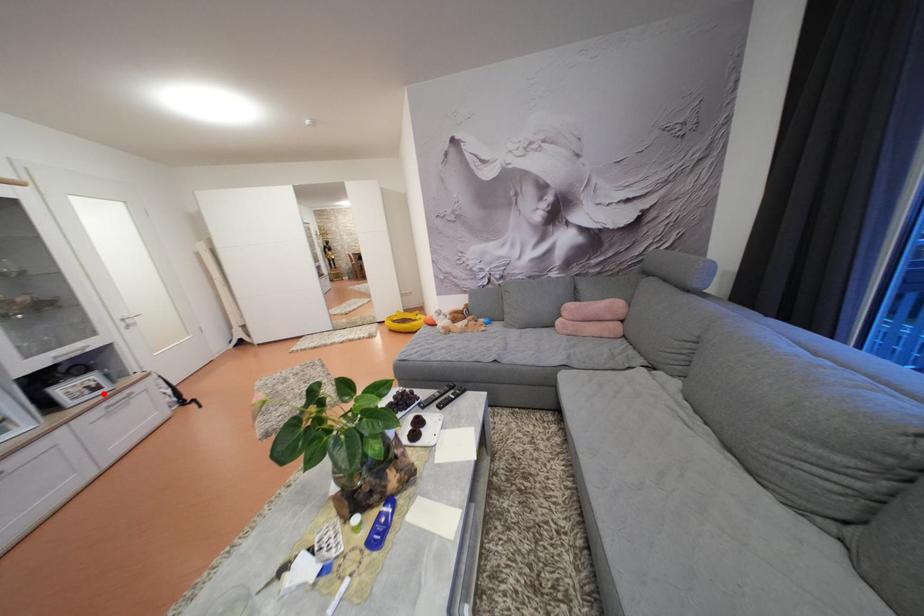
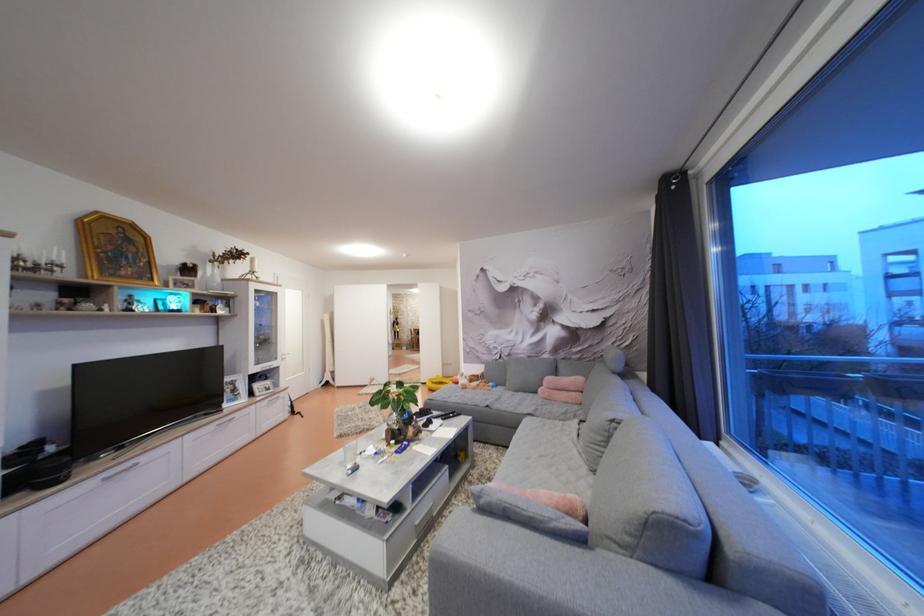
Question: I am providing you with two images of the same scene from different viewpoints. A red point is shown in image1. For the corresponding object point in image2, is it positioned nearer or farther from the camera?

Choices:
 (A) Nearer
 (B) Farther

Answer: (A)